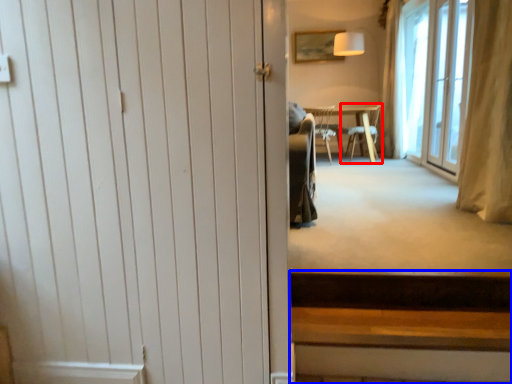
Question: Which point is closer to the camera, chair (highlighted by a red box) or stairs (highlighted by a blue box)?

Choices:
 (A) chair
 (B) stairs

Answer: (B)